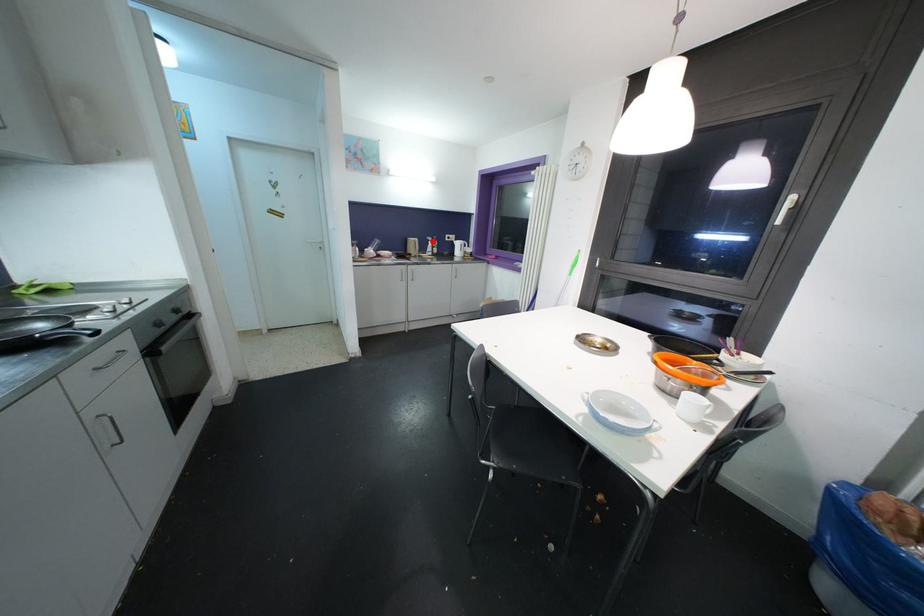
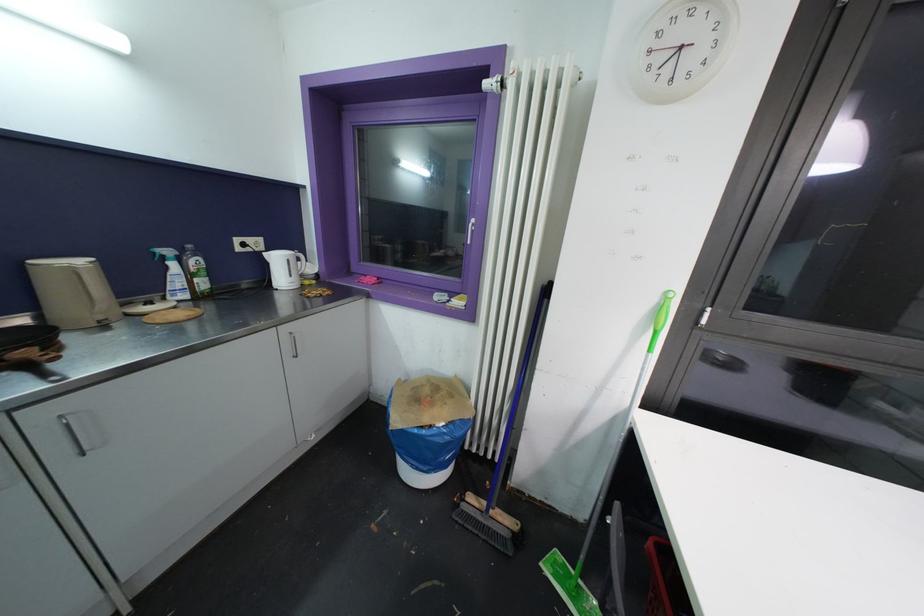
Where in the second image is the point corresponding to the highlighted location from the first image?

(171, 254)